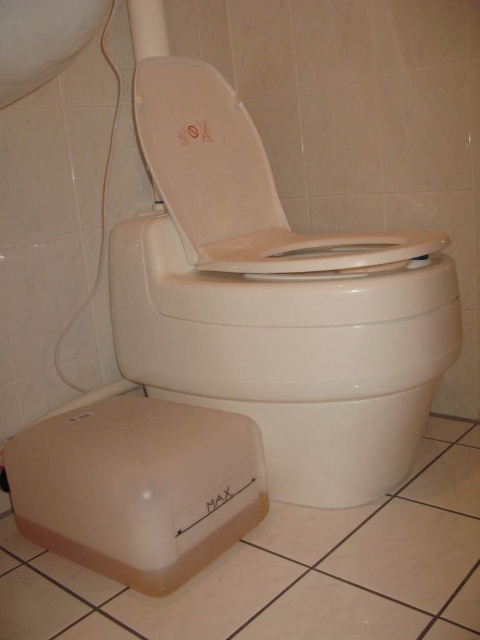
Does point (412, 376) lie in front of point (279, 214)?

Yes, point (412, 376) is closer to viewer.

Between white plastic toilet bowl at center and white matte toilet seat at center, which one is positioned lower?

Positioned lower is white plastic toilet bowl at center.

The width and height of the screenshot is (480, 640). What do you see at coordinates (291, 355) in the screenshot? I see `white plastic toilet bowl at center` at bounding box center [291, 355].

Where is `white plastic toilet bowl at center`? white plastic toilet bowl at center is located at coordinates (291, 355).

Based on the photo, is white plastic toilet seat at center bigger than white matte toilet seat at center?

Indeed, white plastic toilet seat at center has a larger size compared to white matte toilet seat at center.

Is white plastic toilet seat at center to the left of white matte toilet seat at center from the viewer's perspective?

In fact, white plastic toilet seat at center is to the right of white matte toilet seat at center.

Does point (156, 148) come closer to viewer compared to point (192, 141)?

Yes, point (156, 148) is in front of point (192, 141).

Find the location of `white plastic toilet seat at center`. white plastic toilet seat at center is located at coordinates (236, 182).

Who is positioned more to the left, white plastic toilet bowl at center or white plastic toilet seat at center?

From the viewer's perspective, white plastic toilet bowl at center appears more on the left side.

Is white plastic toilet bowl at center smaller than white plastic toilet seat at center?

Indeed, white plastic toilet bowl at center has a smaller size compared to white plastic toilet seat at center.

Who is more distant from viewer, (320, 477) or (405, 253)?

The point (320, 477) is behind.

Where is `white plastic toilet bowl at center`? The image size is (480, 640). white plastic toilet bowl at center is located at coordinates (291, 355).